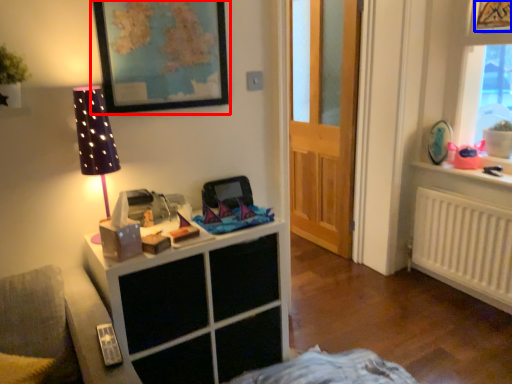
Question: Among these objects, which one is nearest to the camera, picture frame (highlighted by a red box) or picture frame (highlighted by a blue box)?

Choices:
 (A) picture frame
 (B) picture frame

Answer: (A)